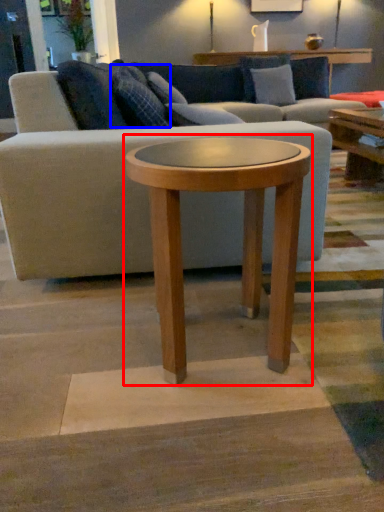
Question: Which point is closer to the camera, coffee table (highlighted by a red box) or pillow (highlighted by a blue box)?

Choices:
 (A) coffee table
 (B) pillow

Answer: (A)